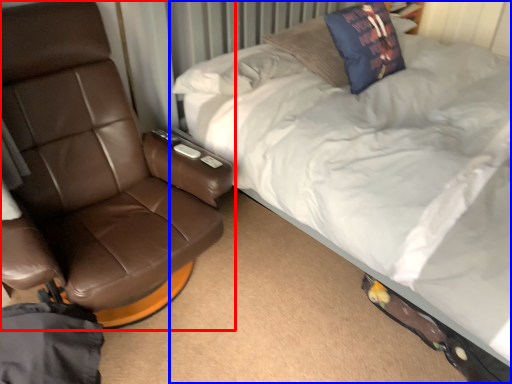
Question: Among these objects, which one is nearest to the camera, chair (highlighted by a red box) or bed (highlighted by a blue box)?

Choices:
 (A) chair
 (B) bed

Answer: (B)